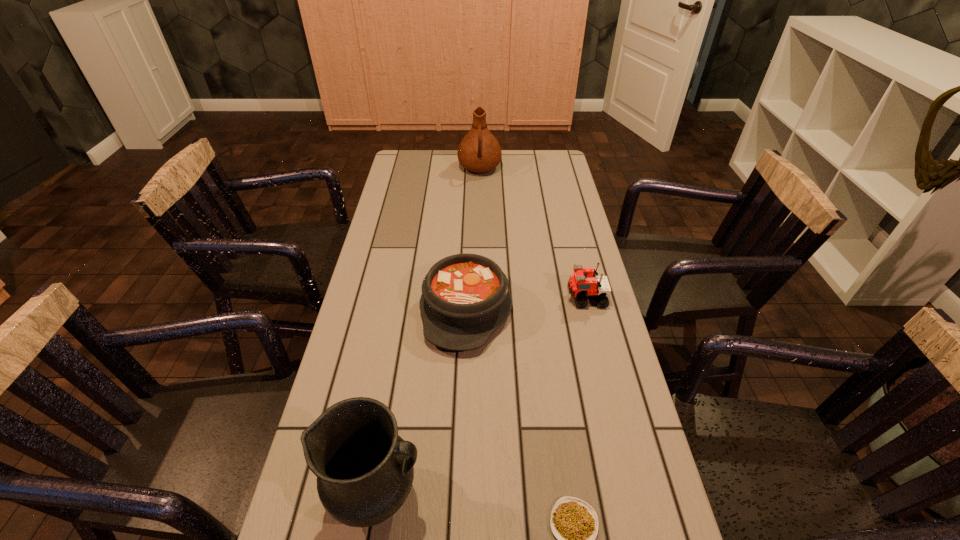
Identify the location of object that can be found as the second closest to the farther pitcher. This screenshot has width=960, height=540. (580, 287).